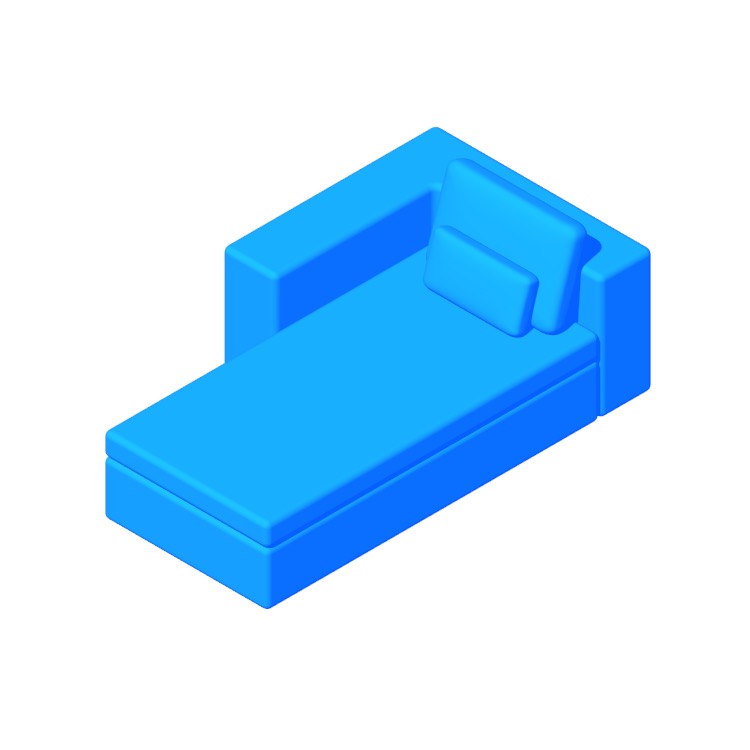
The width and height of the screenshot is (750, 750). In order to click on couch back in this screenshot , I will do `click(602, 232)`.